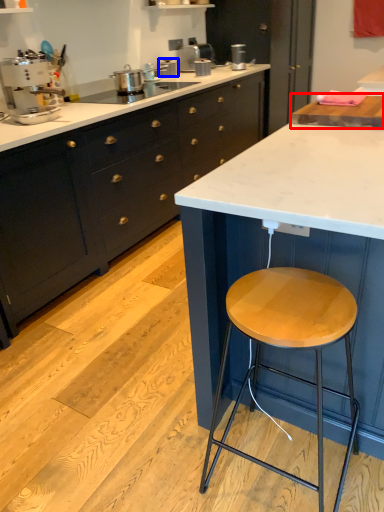
Question: Which point is closer to the camera, countertop (highlighted by a red box) or appliance (highlighted by a blue box)?

Choices:
 (A) countertop
 (B) appliance

Answer: (A)